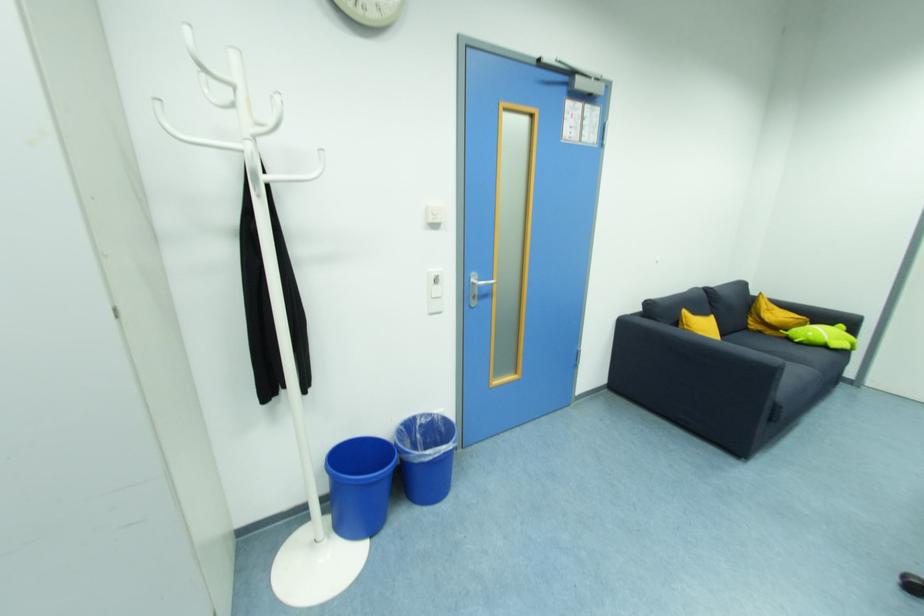
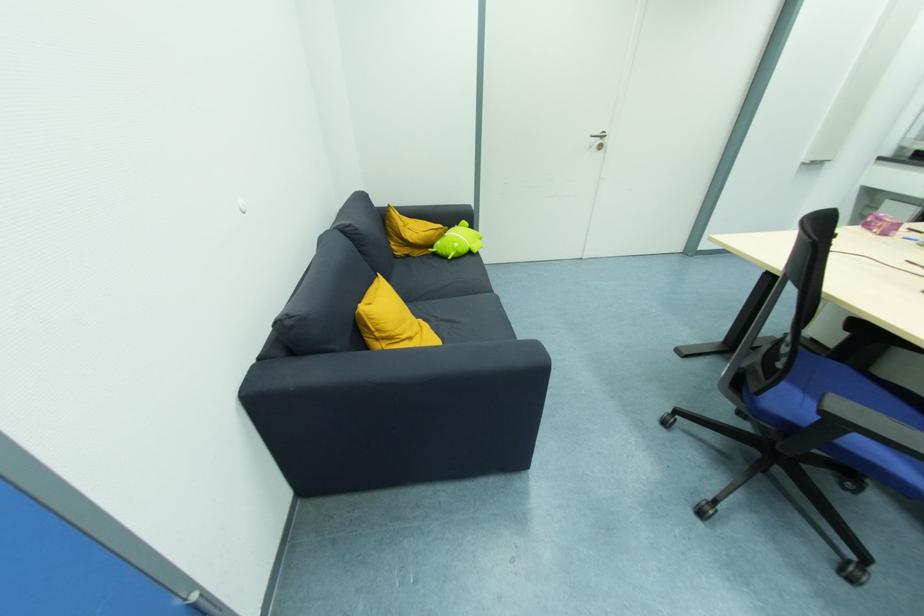
In the second image, find the point that corresponds to [687,318] in the first image.

(372, 321)